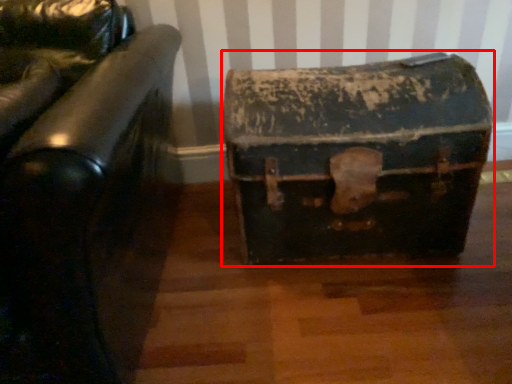
Question: From the image's perspective, where is suitcase (annotated by the red box) located relative to furniture?

Choices:
 (A) below
 (B) above

Answer: (B)